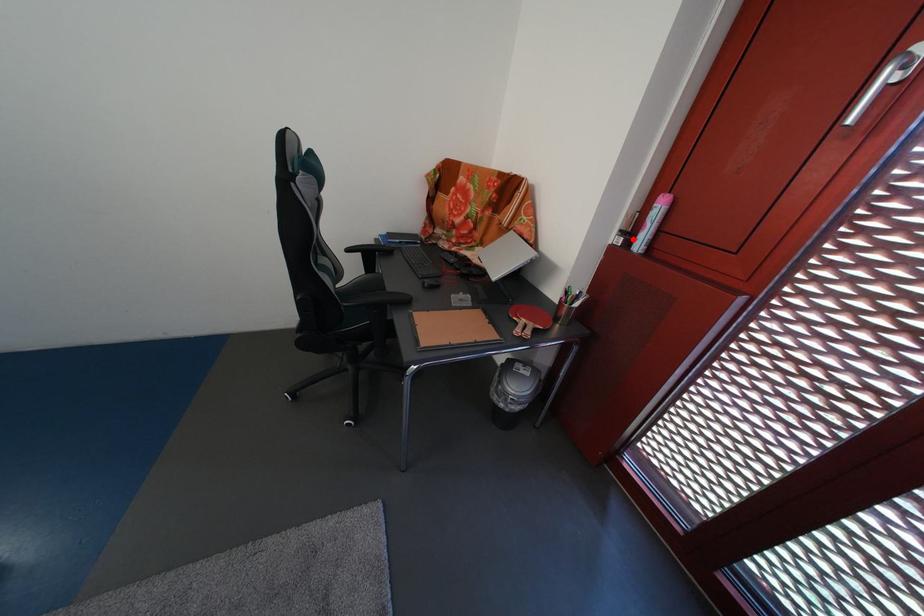
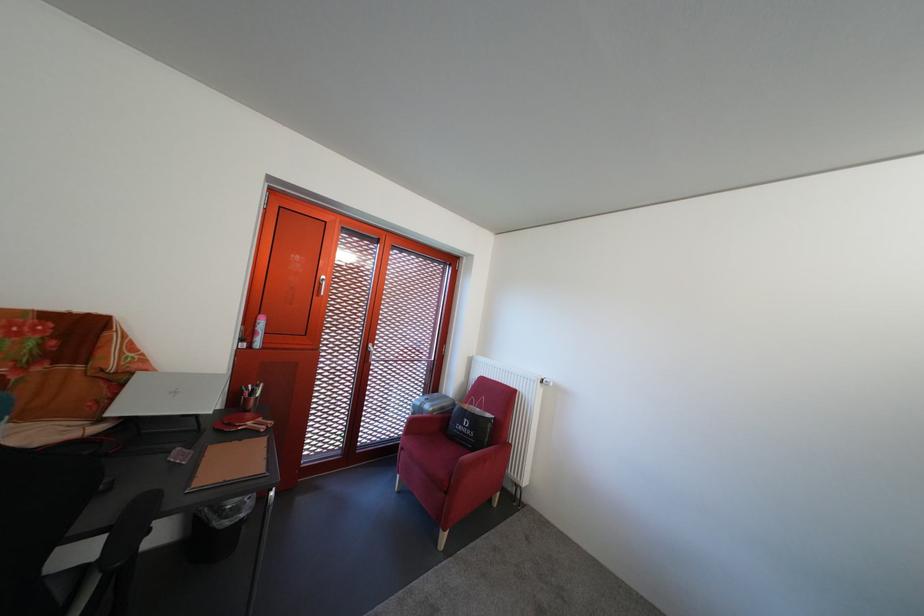
Find the pixel in the second image that matches the highlighted location in the first image.

(252, 346)